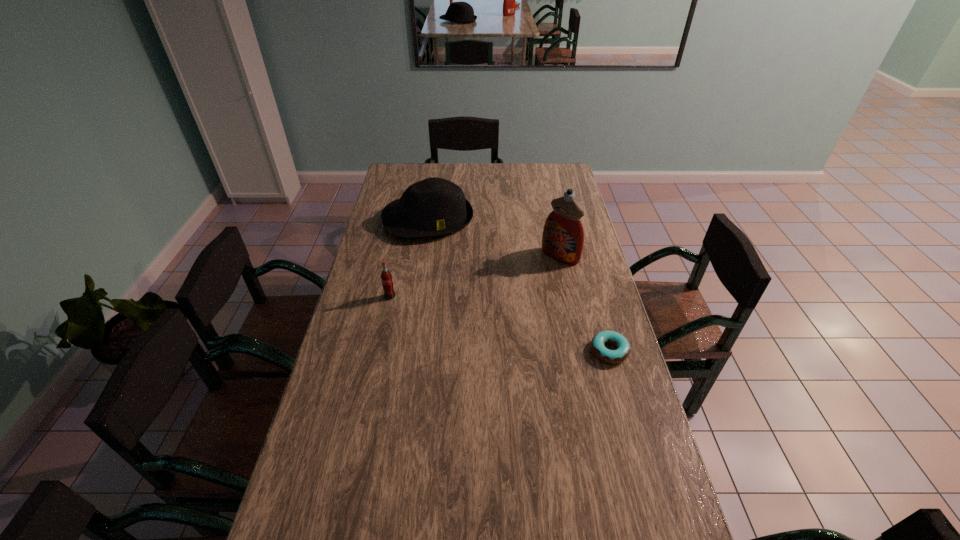
Where is `vacant space that's between the second nearest object and the doughnut`? This screenshot has width=960, height=540. vacant space that's between the second nearest object and the doughnut is located at coordinates (500, 323).

You are a GUI agent. You are given a task and a screenshot of the screen. Output one action in this format:
    pyautogui.click(x=<x>, y=<y>)
    Task: Click on the unoccupied position between the nearest object and the soda bottle
    This screenshot has width=960, height=540.
    Given the screenshot: What is the action you would take?
    pyautogui.click(x=500, y=323)

Locate an element on the screen. The image size is (960, 540). the second closest object to the detergent is located at coordinates (622, 352).

Locate an element on the screen. This screenshot has width=960, height=540. object that ranks as the third closest to the doughnut is located at coordinates click(x=386, y=277).

Where is `free point that satisfies the following two spatial constraints: 1. on the label of the nearest object; 2. on the left side of the third farthest object`? free point that satisfies the following two spatial constraints: 1. on the label of the nearest object; 2. on the left side of the third farthest object is located at coordinates (378, 350).

I want to click on vacant space that satisfies the following two spatial constraints: 1. on the front side of the fedora; 2. on the left side of the nearest object, so click(x=408, y=350).

Where is `vacant point that satisfies the following two spatial constraints: 1. on the label of the shortest object; 2. on the right side of the second nearest object`? The image size is (960, 540). vacant point that satisfies the following two spatial constraints: 1. on the label of the shortest object; 2. on the right side of the second nearest object is located at coordinates (378, 350).